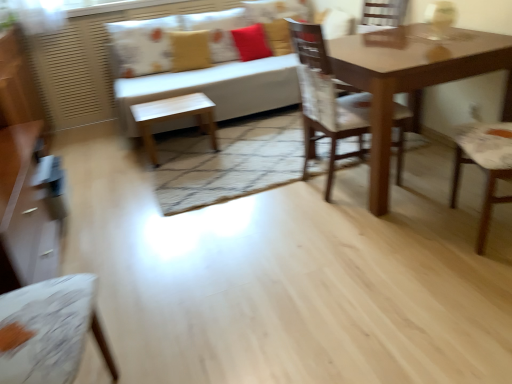
Locate an element on the screen. free space in front of matte brown table at center is located at coordinates (392, 248).